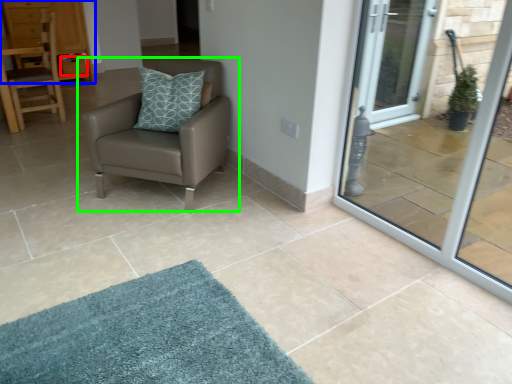
Question: Which object is positioned closest to drawer (highlighted by a red box)? Select from dresser (highlighted by a blue box) and chair (highlighted by a green box).

Choices:
 (A) dresser
 (B) chair

Answer: (A)